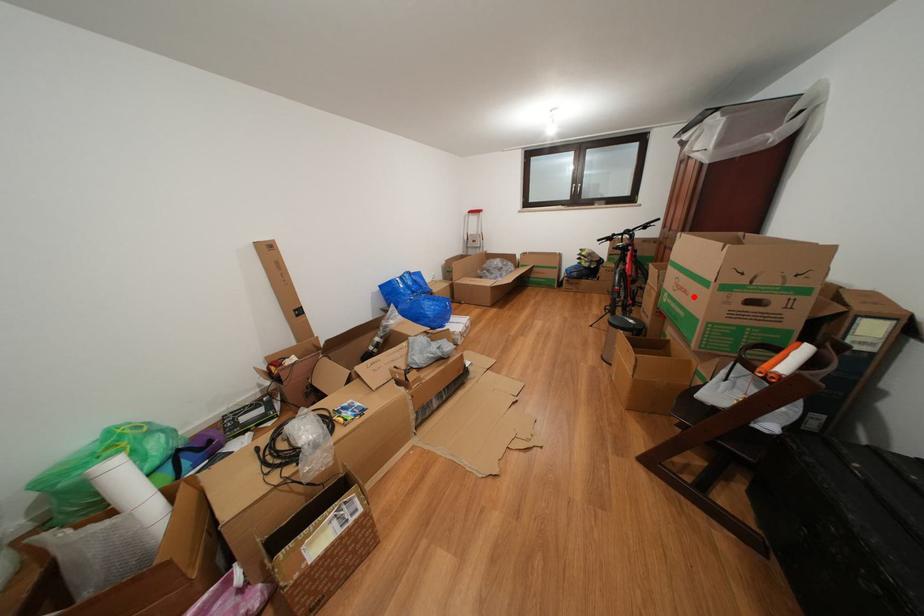
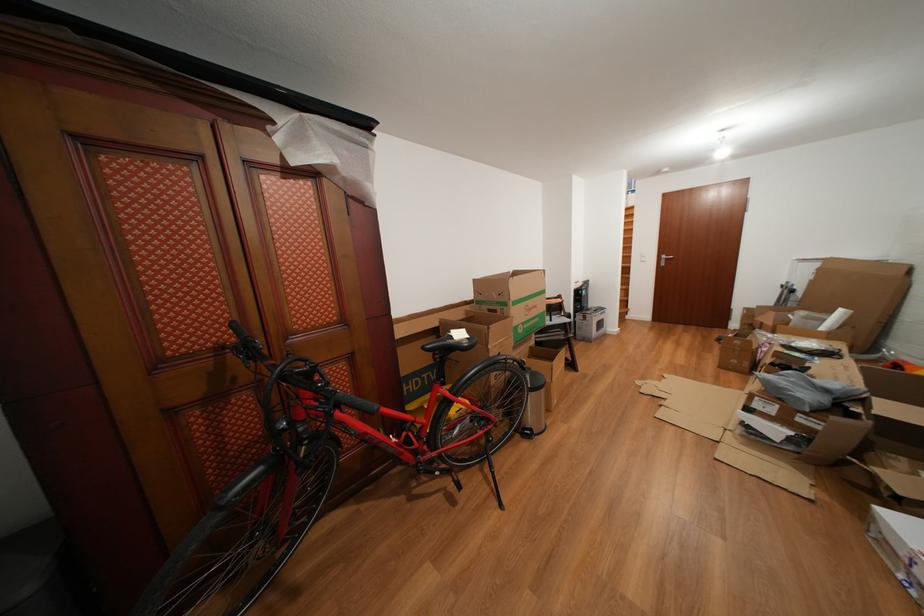
Question: I am providing you with two images of the same scene from different viewpoints. A red point is shown in image1. For the corresponding object point in image2, is it positioned nearer or farther from the camera?

Choices:
 (A) Nearer
 (B) Farther

Answer: (B)